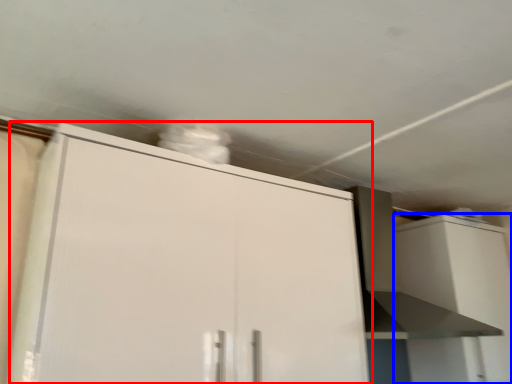
Question: Which of the following is the closest to the observer, cabinetry (highlighted by a red box) or cabinetry (highlighted by a blue box)?

Choices:
 (A) cabinetry
 (B) cabinetry

Answer: (A)